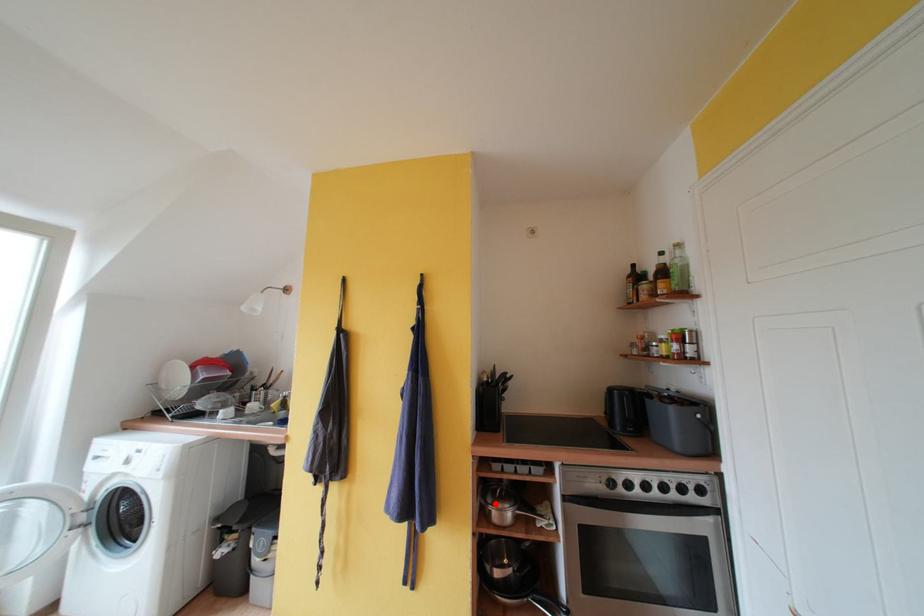
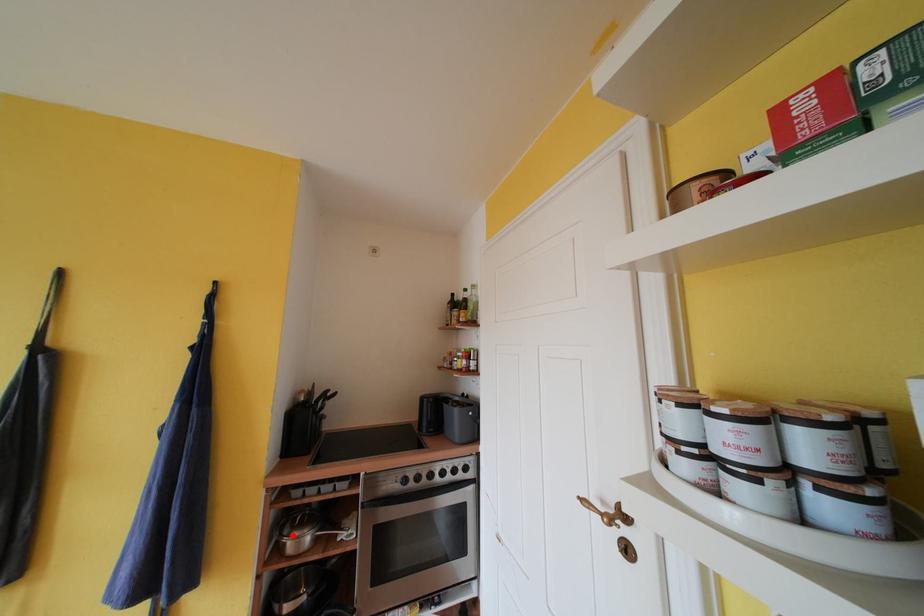
I am providing you with two images of the same scene from different viewpoints. A red point is marked on the first image and another point is marked on the second image. Are the points marked in image1 and image2 representing the same 3D position?

Yes